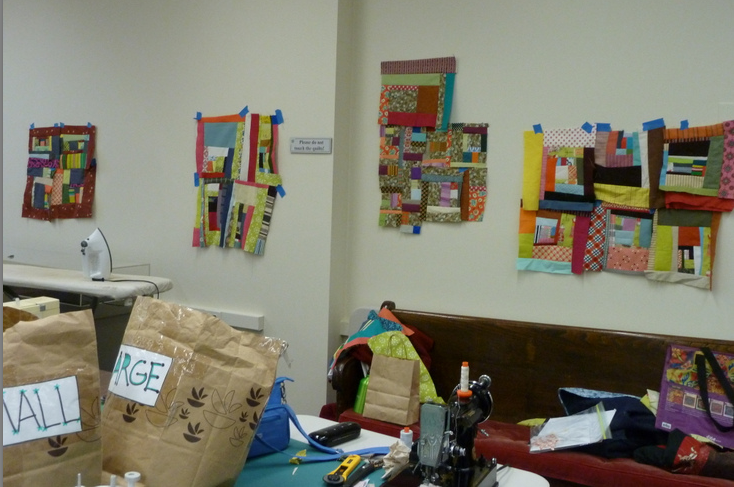
Identify the location of small hanging sign. (324, 146).